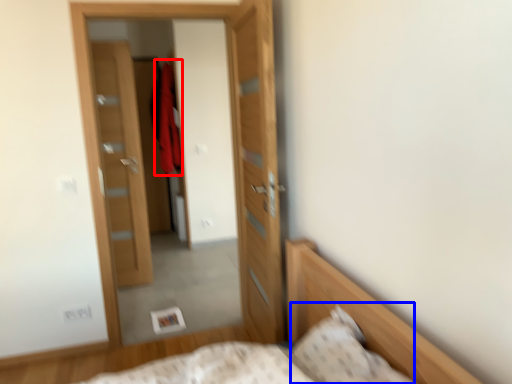
Question: Which point is further to the camera, robe (highlighted by a red box) or pillow (highlighted by a blue box)?

Choices:
 (A) robe
 (B) pillow

Answer: (A)